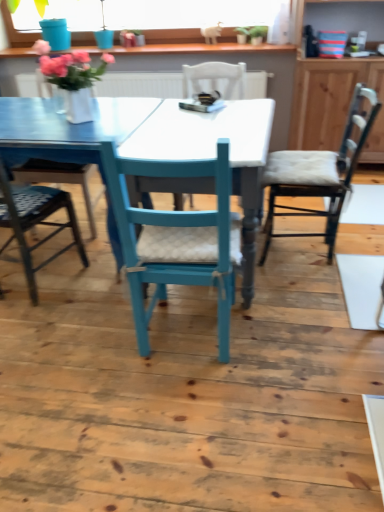
Question: Can green matte plant at upper center be found inside wooden textured chair at right, which is the first chair in right-to-left order?

Choices:
 (A) yes
 (B) no

Answer: (B)

Question: Is wooden textured chair at right, which appears as the third chair when viewed from the left, taller than green matte plant at upper center?

Choices:
 (A) no
 (B) yes

Answer: (B)

Question: Is wooden textured chair at right, which is the first chair in right-to-left order, further to the viewer compared to green matte plant at upper center?

Choices:
 (A) no
 (B) yes

Answer: (A)

Question: Is wooden textured chair at right, which is the first chair in right-to-left order, thinner than green matte plant at upper center?

Choices:
 (A) yes
 (B) no

Answer: (B)

Question: From a real-world perspective, is wooden textured chair at right, which is the first chair in right-to-left order, physically above green matte plant at upper center?

Choices:
 (A) no
 (B) yes

Answer: (A)

Question: From a real-world perspective, relative to wooden cabinet at right, is wooden textured chair at right, which is the first chair in right-to-left order, vertically above or below?

Choices:
 (A) above
 (B) below

Answer: (B)

Question: Does point (289, 158) appear closer or farther from the camera than point (382, 73)?

Choices:
 (A) farther
 (B) closer

Answer: (B)

Question: Visually, is wooden textured chair at right, which appears as the third chair when viewed from the left, positioned to the left or to the right of wooden cabinet at right?

Choices:
 (A) left
 (B) right

Answer: (A)

Question: Looking at their shapes, would you say wooden textured chair at right, which appears as the third chair when viewed from the left, is wider or thinner than wooden cabinet at right?

Choices:
 (A) wide
 (B) thin

Answer: (A)

Question: Considering the positions of matte blue swivel chair at left and metallic silver chair at left, which is counted as the first chair, starting from the left, in the image, is matte blue swivel chair at left taller or shorter than metallic silver chair at left, which is counted as the first chair, starting from the left,?

Choices:
 (A) short
 (B) tall

Answer: (B)

Question: Considering the positions of matte blue swivel chair at left and metallic silver chair at left, the third chair when ordered from right to left, in the image, is matte blue swivel chair at left bigger or smaller than metallic silver chair at left, the third chair when ordered from right to left,?

Choices:
 (A) small
 (B) big

Answer: (B)

Question: Is matte blue swivel chair at left inside the boundaries of metallic silver chair at left, the third chair when ordered from right to left, or outside?

Choices:
 (A) outside
 (B) inside

Answer: (A)

Question: From a real-world perspective, is matte blue swivel chair at left above or below metallic silver chair at left, the third chair when ordered from right to left?

Choices:
 (A) below
 (B) above

Answer: (A)

Question: Is metallic silver chair at left, the third chair when ordered from right to left, in front of or behind green matte plant at upper center in the image?

Choices:
 (A) front
 (B) behind

Answer: (A)

Question: In terms of width, does metallic silver chair at left, which is counted as the first chair, starting from the left, look wider or thinner when compared to green matte plant at upper center?

Choices:
 (A) wide
 (B) thin

Answer: (A)